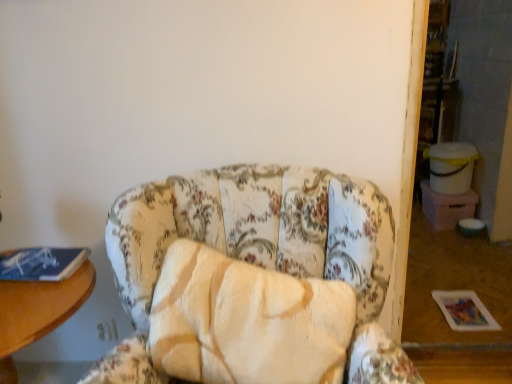
Question: From the image's perspective, would you say blue matte book at left is positioned over floral fabric chair at center?

Choices:
 (A) yes
 (B) no

Answer: (A)

Question: Can you confirm if blue matte book at left is thinner than floral fabric chair at center?

Choices:
 (A) yes
 (B) no

Answer: (A)

Question: Can you confirm if blue matte book at left is smaller than floral fabric chair at center?

Choices:
 (A) yes
 (B) no

Answer: (A)

Question: Is the depth of blue matte book at left less than that of floral fabric chair at center?

Choices:
 (A) yes
 (B) no

Answer: (B)

Question: From the image's perspective, is blue matte book at left located beneath floral fabric chair at center?

Choices:
 (A) no
 (B) yes

Answer: (A)

Question: Is blue matte book at left taller than floral fabric chair at center?

Choices:
 (A) no
 (B) yes

Answer: (A)

Question: Is floral fabric chair at center directly adjacent to wooden table at left?

Choices:
 (A) no
 (B) yes

Answer: (A)

Question: Is floral fabric chair at center not near wooden table at left?

Choices:
 (A) yes
 (B) no

Answer: (B)

Question: Is floral fabric chair at center smaller than wooden table at left?

Choices:
 (A) no
 (B) yes

Answer: (A)

Question: Considering the relative positions of floral fabric chair at center and wooden table at left in the image provided, is floral fabric chair at center in front of wooden table at left?

Choices:
 (A) yes
 (B) no

Answer: (A)

Question: Is floral fabric chair at center positioned behind wooden table at left?

Choices:
 (A) no
 (B) yes

Answer: (A)

Question: From the image's perspective, is floral fabric chair at center below wooden table at left?

Choices:
 (A) yes
 (B) no

Answer: (B)

Question: Are blue matte book at left and wooden table at left located far from each other?

Choices:
 (A) no
 (B) yes

Answer: (A)